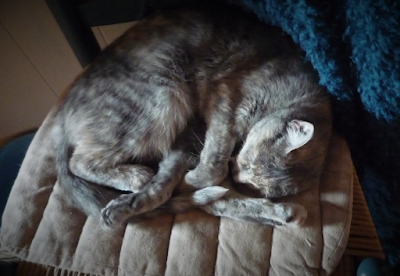
The height and width of the screenshot is (276, 400). In order to click on cushion in this screenshot , I will do tap(242, 249).